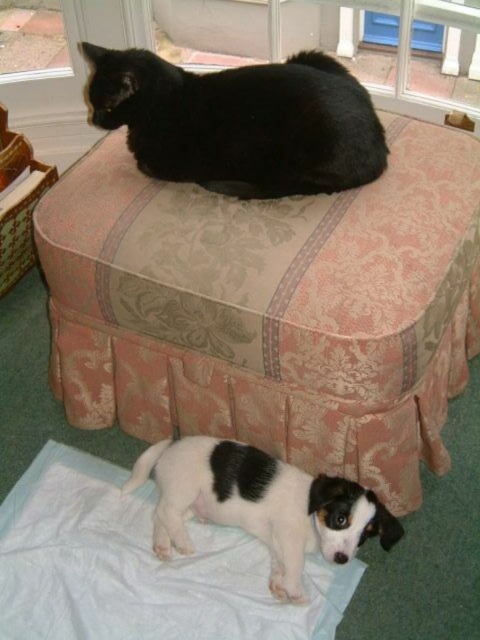
Question: Which is nearer to the pink damask ottoman at upper center?

Choices:
 (A) white-furred dog at lower left
 (B) black fur cat at upper center

Answer: (B)

Question: Is black fur cat at upper center behind white-furred dog at lower left?

Choices:
 (A) no
 (B) yes

Answer: (B)

Question: Which point is farther from the camera taking this photo?

Choices:
 (A) (292, 589)
 (B) (253, 112)

Answer: (B)

Question: Can you confirm if pink damask ottoman at upper center is positioned to the left of black fur cat at upper center?

Choices:
 (A) yes
 (B) no

Answer: (B)

Question: Which point is farther to the camera?

Choices:
 (A) pink damask ottoman at upper center
 (B) white-furred dog at lower left
 (C) black fur cat at upper center

Answer: (C)

Question: Is the position of black fur cat at upper center less distant than that of white-furred dog at lower left?

Choices:
 (A) yes
 (B) no

Answer: (B)